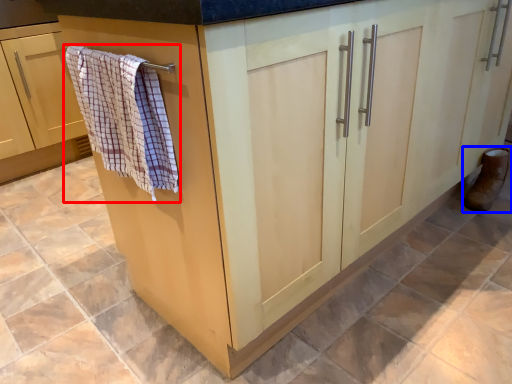
Question: Which object appears farthest to the camera in this image, bath towel (highlighted by a red box) or footwear (highlighted by a blue box)?

Choices:
 (A) bath towel
 (B) footwear

Answer: (B)